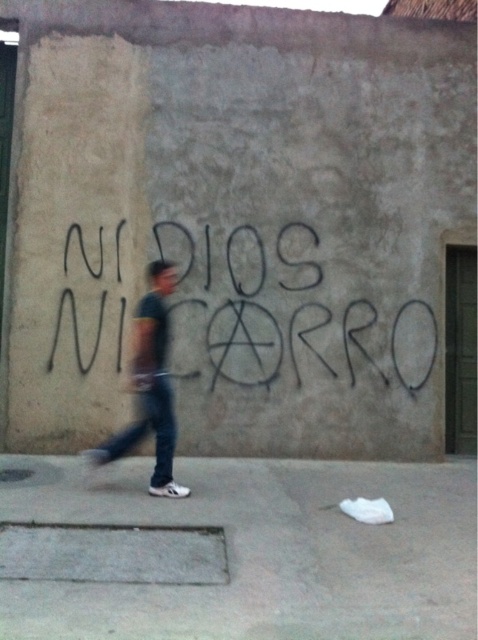
Is gray concrete pavement at lower center to the left of dark blue jeans at center from the viewer's perspective?

In fact, gray concrete pavement at lower center is to the right of dark blue jeans at center.

Find the location of `gray concrete pavement at lower center`. gray concrete pavement at lower center is located at coordinates (265, 552).

Between point (370, 556) and point (141, 384), which one is positioned in front?

Point (370, 556) is more forward.

Identify the location of gray concrete pavement at lower center. The width and height of the screenshot is (478, 640). (265, 552).

Find the location of `black graffiti at center`. black graffiti at center is located at coordinates (284, 312).

Is black graffiti at center wider than dark blue jeans at center?

Indeed, black graffiti at center has a greater width compared to dark blue jeans at center.

Between point (83, 372) and point (162, 260), which one is positioned in front?

Point (83, 372) is in front.

Where is `black graffiti at center`? This screenshot has width=478, height=640. black graffiti at center is located at coordinates (284, 312).

Does gray concrete pavement at lower center appear on the right side of black graffiti at center?

Correct, you'll find gray concrete pavement at lower center to the right of black graffiti at center.

Does gray concrete pavement at lower center appear over black graffiti at center?

Incorrect, gray concrete pavement at lower center is not positioned above black graffiti at center.

Locate an element on the screen. This screenshot has height=640, width=478. gray concrete pavement at lower center is located at coordinates (265, 552).

What are the coordinates of `gray concrete pavement at lower center` in the screenshot? It's located at (265, 552).